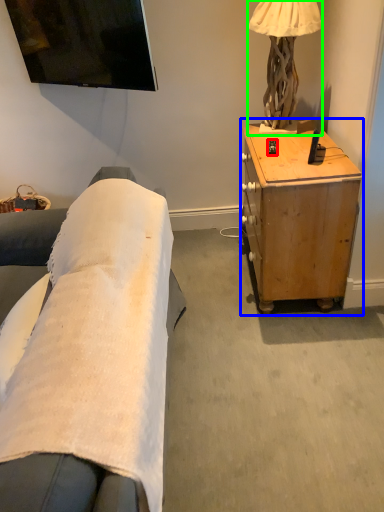
Question: Considering the real-world distances, which object is closest to remote control (highlighted by a red box)? desk (highlighted by a blue box) or lamp (highlighted by a green box).

Choices:
 (A) desk
 (B) lamp

Answer: (B)